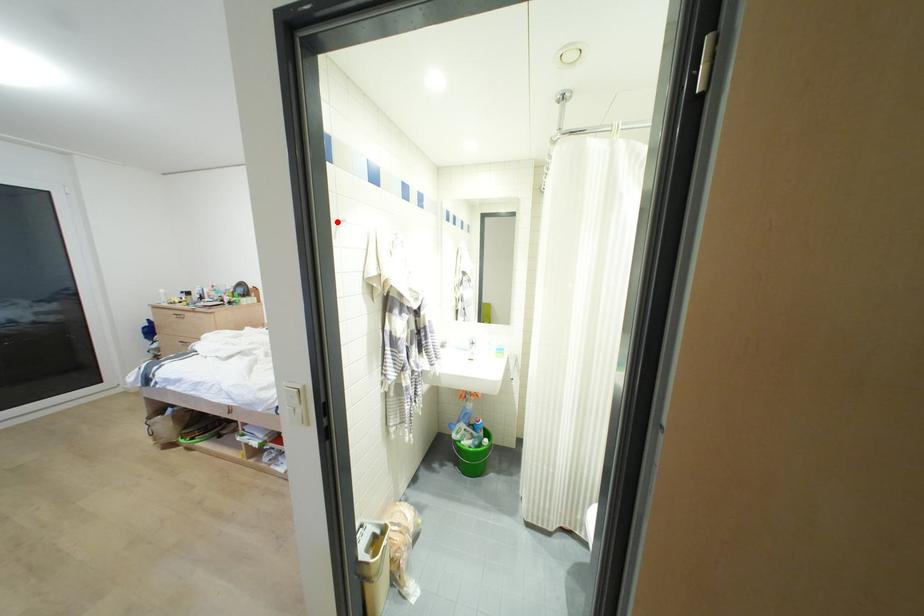
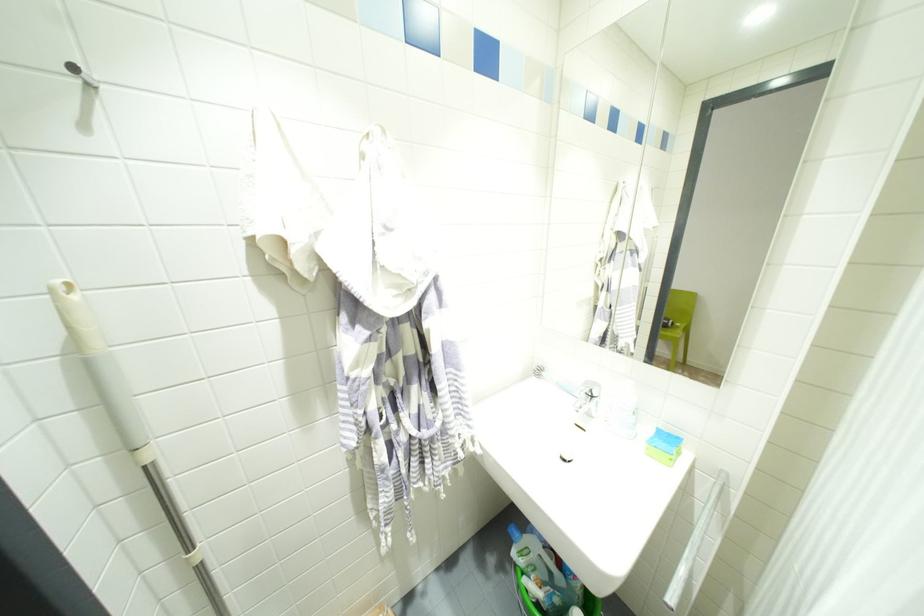
Question: I am providing you with two images of the same scene from different viewpoints. A red point is shown in image1. For the corresponding object point in image2, is it positioned nearer or farther from the camera?

Choices:
 (A) Nearer
 (B) Farther

Answer: (B)